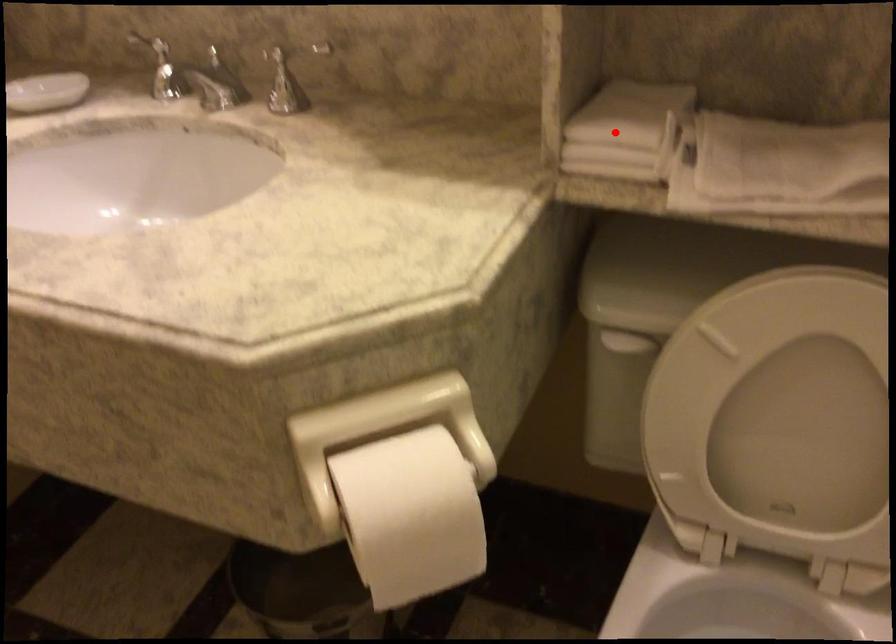
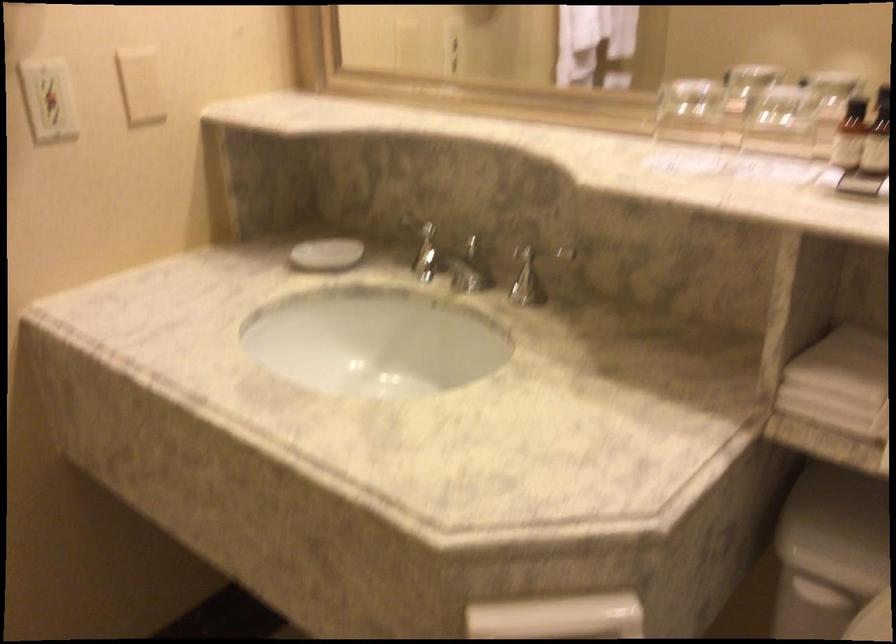
Find the pixel in the second image that matches the highlighted location in the first image.

(840, 383)